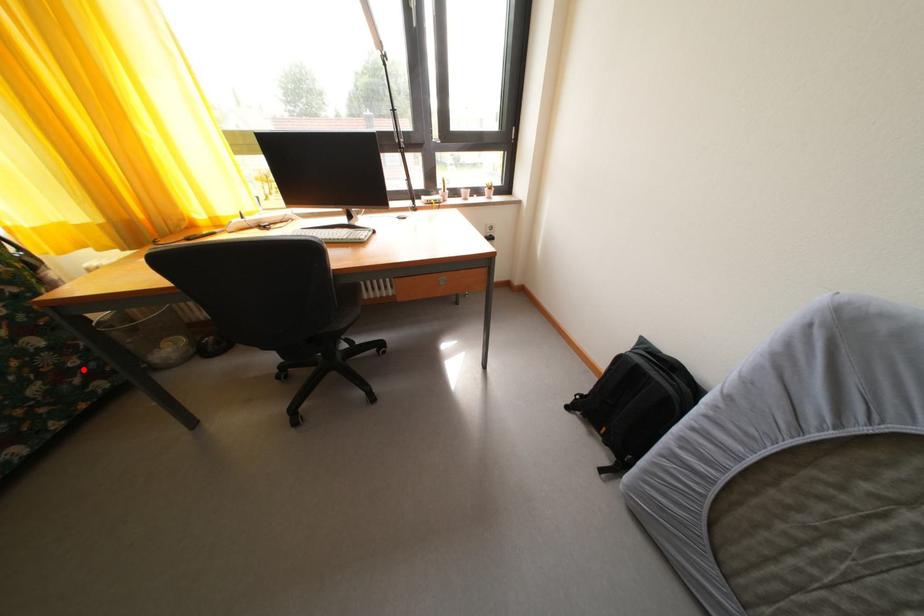
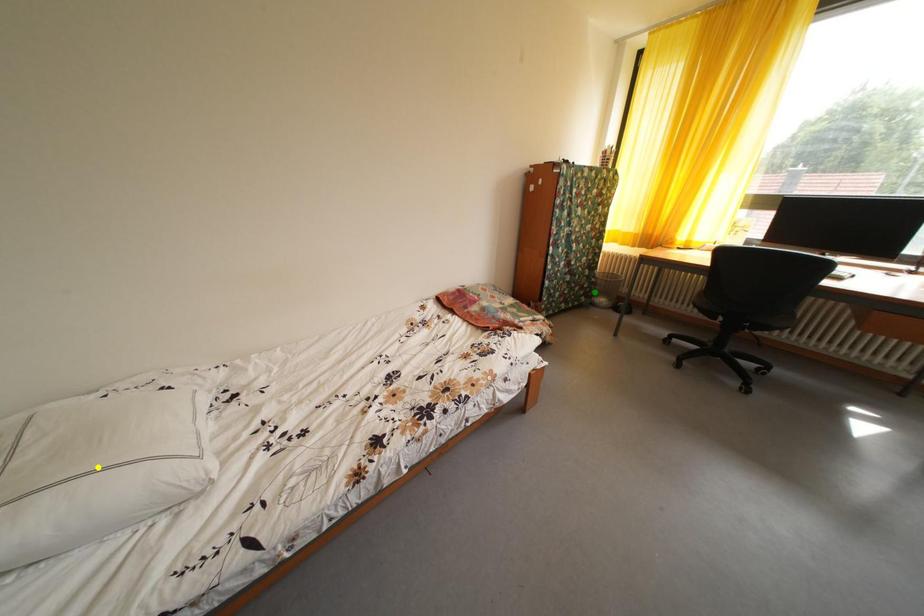
Question: I am providing you with two images of the same scene from different viewpoints. A red point is marked on the first image. You are given multiple points on the second image. Which spot in image 2 lines up with the point in image 1?

Choices:
 (A) green point
 (B) blue point
 (C) yellow point

Answer: (A)